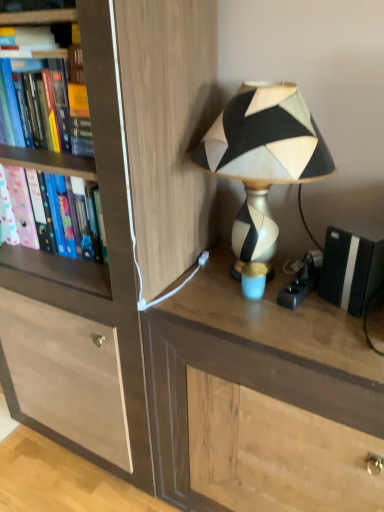
You are a GUI agent. You are given a task and a screenshot of the screen. Output one action in this format:
    pyautogui.click(x=<x>, y=<y>)
    Task: Click on the vacant space to the left of black matte speaker at right
    The width and height of the screenshot is (384, 512).
    Given the screenshot: What is the action you would take?
    pyautogui.click(x=292, y=317)